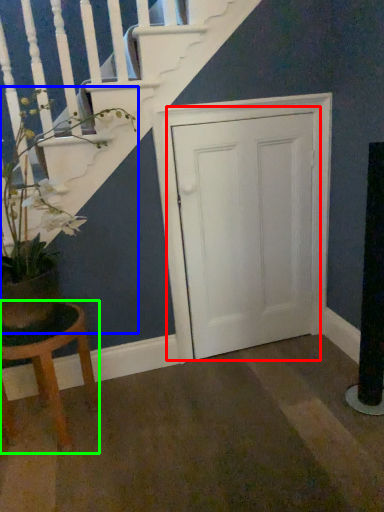
Question: Which is farther away from door (highlighted by a red box)? houseplant (highlighted by a blue box) or stool (highlighted by a green box)?

Choices:
 (A) houseplant
 (B) stool

Answer: (B)